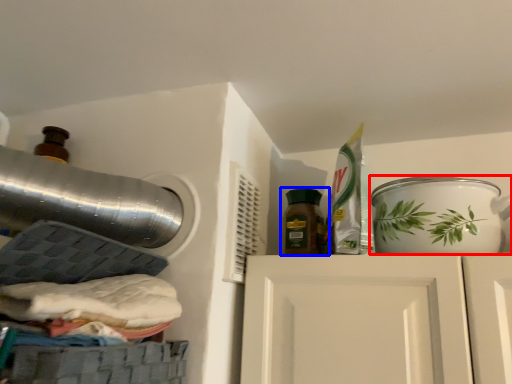
Question: Which point is closer to the camera, tableware (highlighted by a red box) or bottle (highlighted by a blue box)?

Choices:
 (A) tableware
 (B) bottle

Answer: (A)